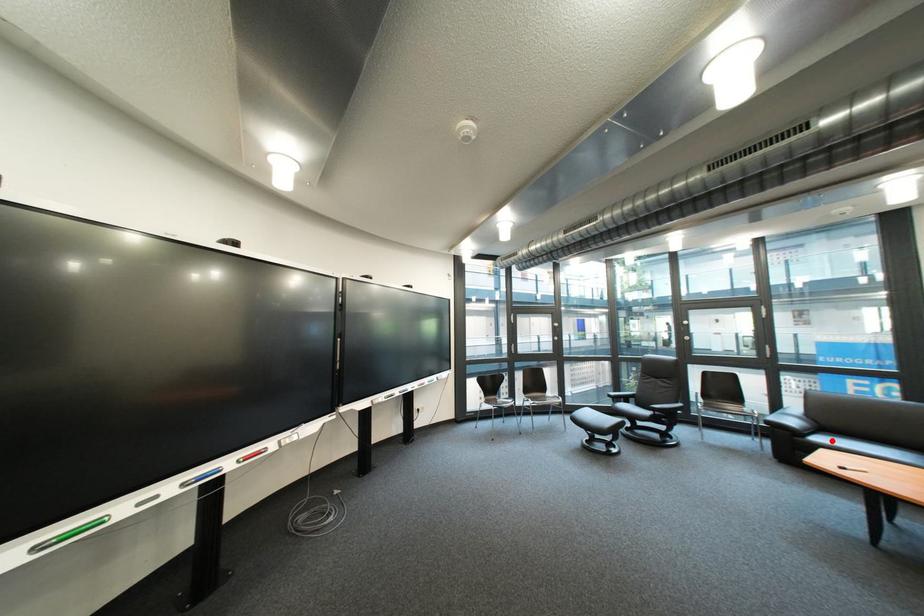
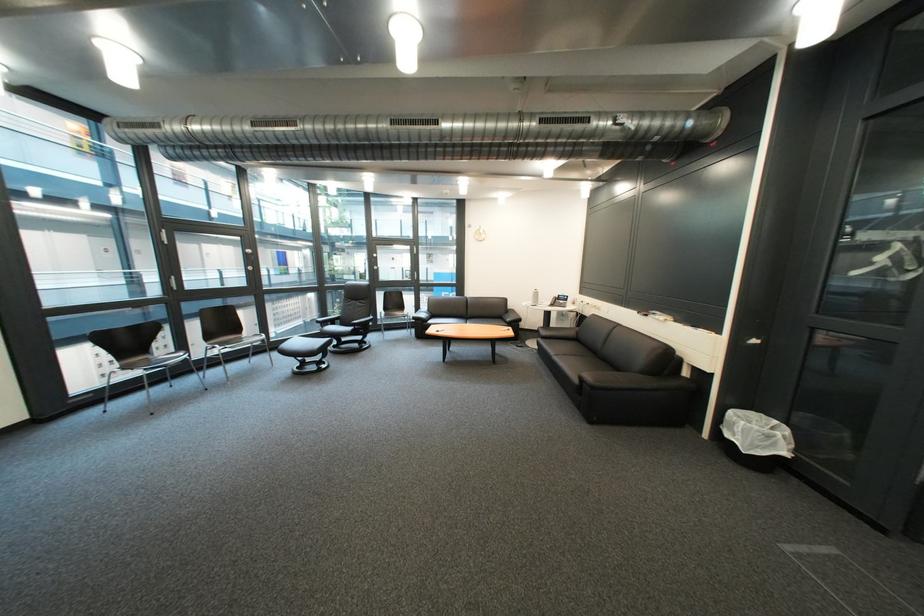
The point at the highlighted location is marked in the first image. Where is the corresponding point in the second image?

(444, 323)